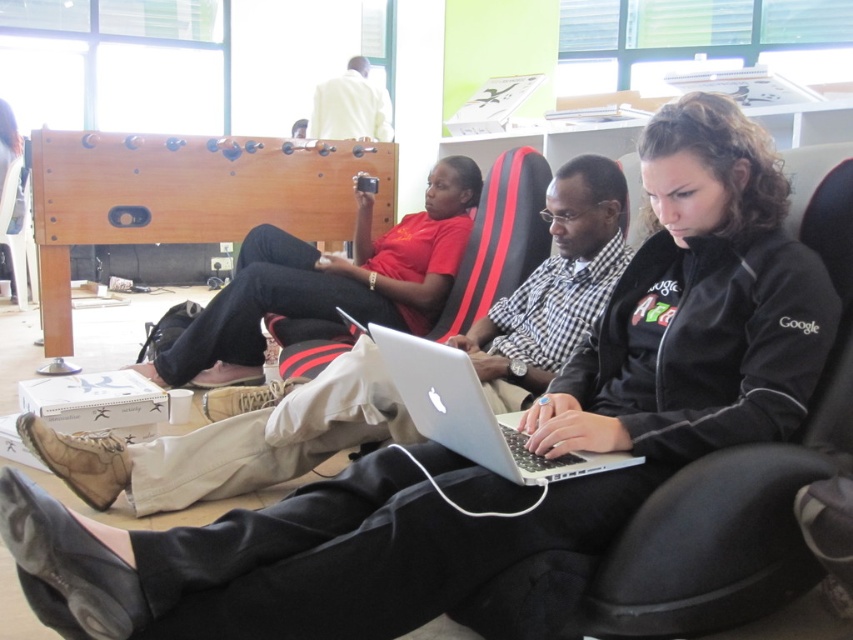
Is matte black laptop at center below silver metallic laptop at center?

Incorrect, matte black laptop at center is not positioned below silver metallic laptop at center.

Is point (325, 282) positioned after point (560, 461)?

Yes.

Locate an element on the screen. matte black laptop at center is located at coordinates (328, 282).

Between black fabric chair at center and silver metallic laptop at center, which one has more height?

black fabric chair at center is taller.

The width and height of the screenshot is (853, 640). I want to click on black fabric chair at center, so click(746, 483).

Is point (607, 557) behind point (456, 392)?

Yes.

I want to click on black fabric chair at center, so click(x=746, y=483).

Does black fabric chair at center have a smaller size compared to white matte shirt at upper center?

Yes.

Who is more distant from viewer, (x=630, y=621) or (x=354, y=96)?

Point (x=354, y=96)

Does point (703, 604) lie behind point (364, 92)?

No, (703, 604) is closer to viewer.

Identify the location of black fabric chair at center. pos(746,483).